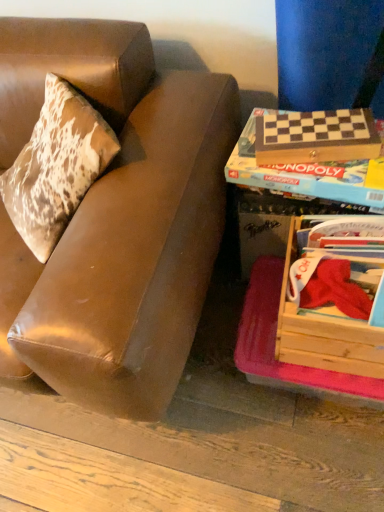
Question: Considering the relative sizes of brown leather couch at left and wooden checkered board at right, placed as the 1th paperback book when sorted from bottom to top, in the image provided, is brown leather couch at left wider than wooden checkered board at right, placed as the 1th paperback book when sorted from bottom to top,?

Choices:
 (A) yes
 (B) no

Answer: (A)

Question: Is brown leather couch at left smaller than wooden checkered board at right, placed as the 1th paperback book when sorted from bottom to top?

Choices:
 (A) no
 (B) yes

Answer: (A)

Question: Is brown leather couch at left positioned behind wooden checkered board at right, placed as the 1th paperback book when sorted from bottom to top?

Choices:
 (A) yes
 (B) no

Answer: (B)

Question: Does brown leather couch at left have a greater height compared to wooden checkered board at right, placed as the 1th paperback book when sorted from bottom to top?

Choices:
 (A) no
 (B) yes

Answer: (B)

Question: Considering the relative sizes of brown leather couch at left and wooden checkered board at right, placed as the 1th paperback book when sorted from bottom to top, in the image provided, is brown leather couch at left bigger than wooden checkered board at right, placed as the 1th paperback book when sorted from bottom to top,?

Choices:
 (A) yes
 (B) no

Answer: (A)

Question: Is wooden crate at lower right in front of or behind brown leather couch at left in the image?

Choices:
 (A) front
 (B) behind

Answer: (B)

Question: Is wooden crate at lower right spatially inside brown leather couch at left, or outside of it?

Choices:
 (A) outside
 (B) inside

Answer: (A)

Question: Is wooden crate at lower right to the left or to the right of brown leather couch at left in the image?

Choices:
 (A) left
 (B) right

Answer: (B)

Question: Based on their sizes in the image, would you say wooden crate at lower right is bigger or smaller than brown leather couch at left?

Choices:
 (A) big
 (B) small

Answer: (B)

Question: Looking at their shapes, would you say wooden checkered board at right, the second paperback book in the top-to-bottom sequence, is wider or thinner than wooden crate at lower right?

Choices:
 (A) thin
 (B) wide

Answer: (A)

Question: Is point (274, 165) positioned closer to the camera than point (292, 224)?

Choices:
 (A) closer
 (B) farther

Answer: (A)

Question: From the image's perspective, relative to wooden crate at lower right, is wooden checkered board at right, the second paperback book in the top-to-bottom sequence, above or below?

Choices:
 (A) below
 (B) above

Answer: (B)

Question: Is wooden checkered board at right, placed as the 1th paperback book when sorted from bottom to top, spatially inside wooden crate at lower right, or outside of it?

Choices:
 (A) inside
 (B) outside

Answer: (B)

Question: Would you say wooden crate at lower right is to the left or to the right of wooden monopoly box at right in the picture?

Choices:
 (A) left
 (B) right

Answer: (B)

Question: Is point (284, 260) positioned closer to the camera than point (269, 250)?

Choices:
 (A) farther
 (B) closer

Answer: (B)